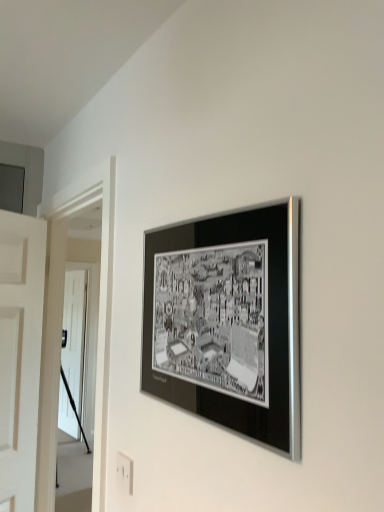
Question: Considering the relative sizes of white plastic electric outlet at lower center and black metallic frame at upper center in the image provided, is white plastic electric outlet at lower center taller than black metallic frame at upper center?

Choices:
 (A) no
 (B) yes

Answer: (A)

Question: Can you confirm if white plastic electric outlet at lower center is positioned to the right of black metallic frame at upper center?

Choices:
 (A) no
 (B) yes

Answer: (A)

Question: Is white plastic electric outlet at lower center positioned before black metallic frame at upper center?

Choices:
 (A) no
 (B) yes

Answer: (A)

Question: Is white plastic electric outlet at lower center to the left of black metallic frame at upper center from the viewer's perspective?

Choices:
 (A) yes
 (B) no

Answer: (A)

Question: Are white plastic electric outlet at lower center and black metallic frame at upper center beside each other?

Choices:
 (A) yes
 (B) no

Answer: (B)

Question: Considering the relative positions of white plastic electric outlet at lower center and black metallic frame at upper center in the image provided, is white plastic electric outlet at lower center to the left or to the right of black metallic frame at upper center?

Choices:
 (A) right
 (B) left

Answer: (B)

Question: In terms of height, does white plastic electric outlet at lower center look taller or shorter compared to black metallic frame at upper center?

Choices:
 (A) tall
 (B) short

Answer: (B)

Question: Is white plastic electric outlet at lower center inside or outside of black metallic frame at upper center?

Choices:
 (A) outside
 (B) inside

Answer: (A)

Question: Considering their positions, is white plastic electric outlet at lower center located in front of or behind black metallic frame at upper center?

Choices:
 (A) behind
 (B) front

Answer: (A)

Question: From a real-world perspective, is white glossy door at left physically located above or below black metallic frame at upper center?

Choices:
 (A) below
 (B) above

Answer: (A)

Question: Looking at the image, does white glossy door at left seem bigger or smaller compared to black metallic frame at upper center?

Choices:
 (A) big
 (B) small

Answer: (A)

Question: Is white glossy door at left wider or thinner than black metallic frame at upper center?

Choices:
 (A) wide
 (B) thin

Answer: (B)

Question: Based on their positions, is white glossy door at left located to the left or right of black metallic frame at upper center?

Choices:
 (A) right
 (B) left

Answer: (B)

Question: Considering the positions of black metallic frame at upper center and white plastic electric outlet at lower center in the image, is black metallic frame at upper center wider or thinner than white plastic electric outlet at lower center?

Choices:
 (A) thin
 (B) wide

Answer: (B)

Question: Do you think black metallic frame at upper center is within white plastic electric outlet at lower center, or outside of it?

Choices:
 (A) inside
 (B) outside

Answer: (B)